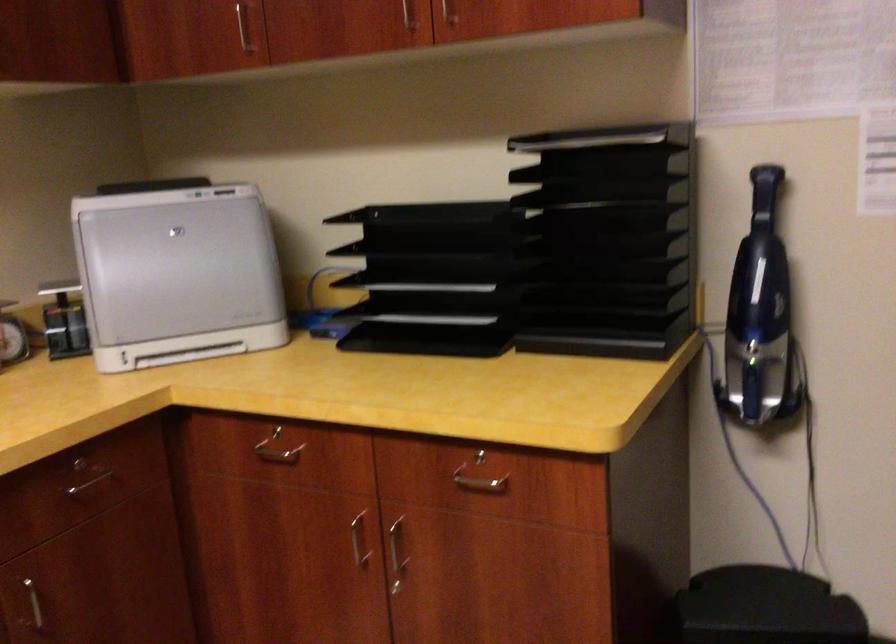
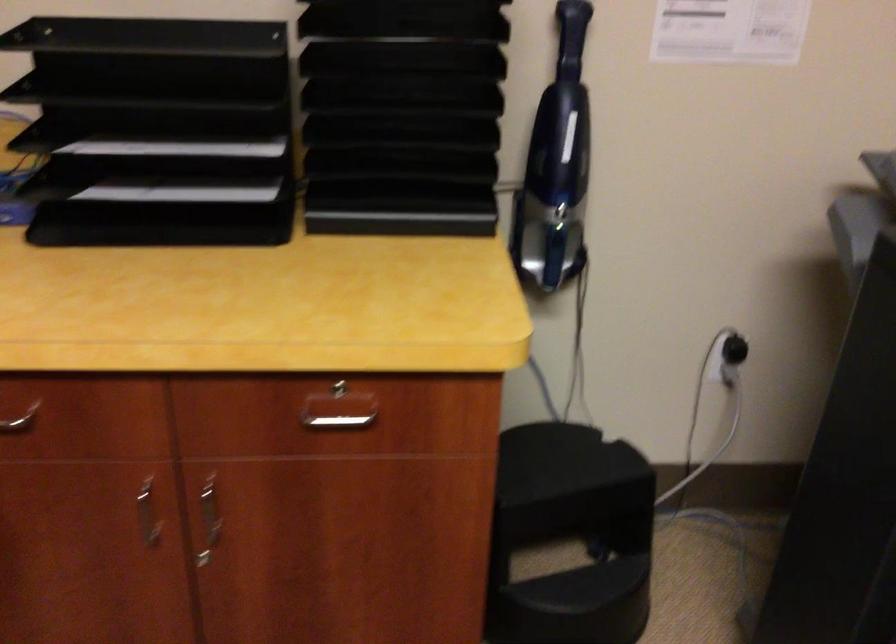
The point at [765,192] is marked in the first image. Where is the corresponding point in the second image?

(571, 37)